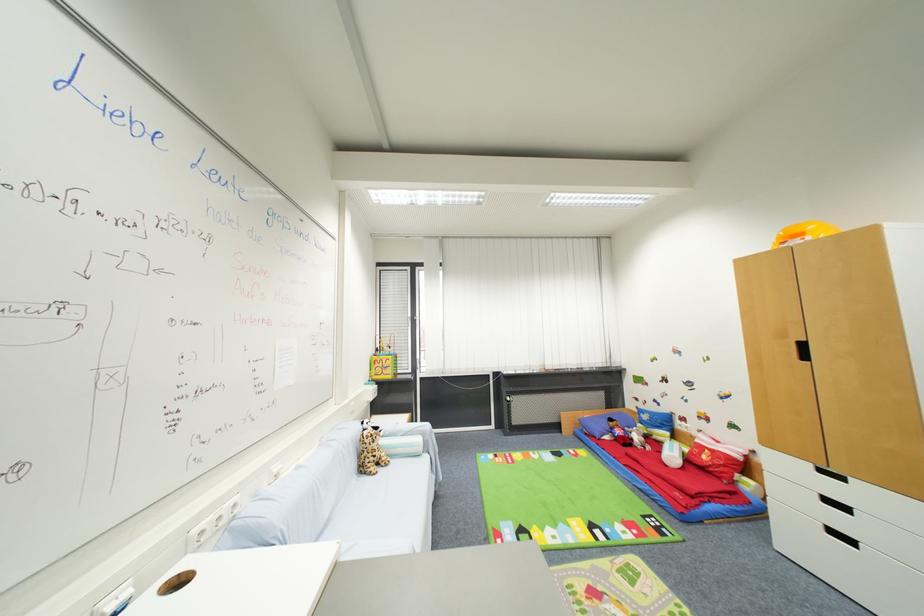
At what (x,y) coordinates should I click in order to perform the action: click on blue cylindrical pillow. Please return your answer as a coordinate pair (x, y). This screenshot has height=616, width=924. Looking at the image, I should click on (655, 424).